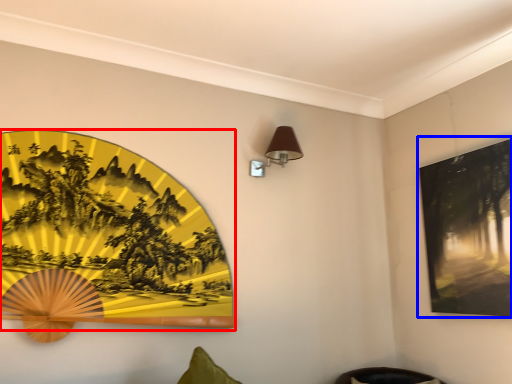
Question: Which point is closer to the camera, picture frame (highlighted by a red box) or picture frame (highlighted by a blue box)?

Choices:
 (A) picture frame
 (B) picture frame

Answer: (A)